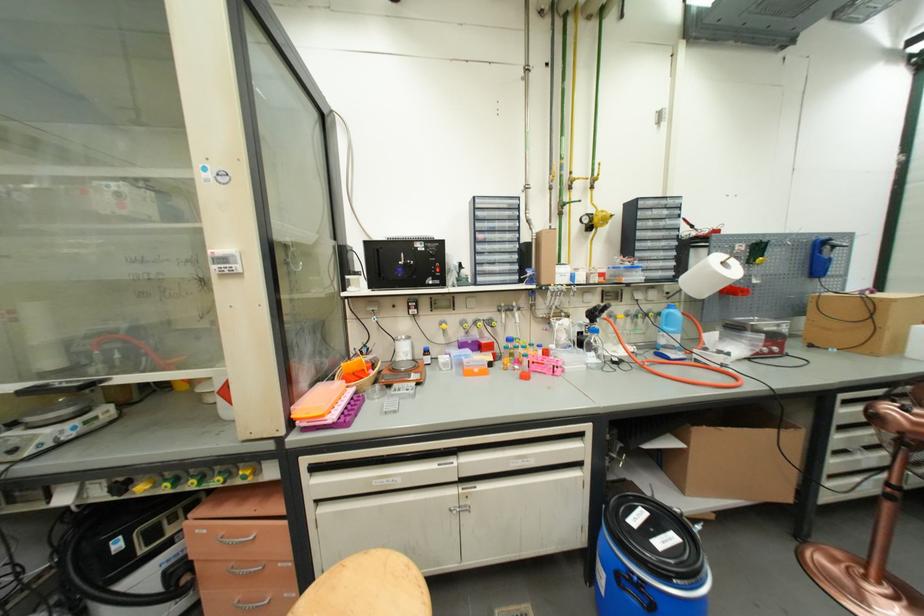
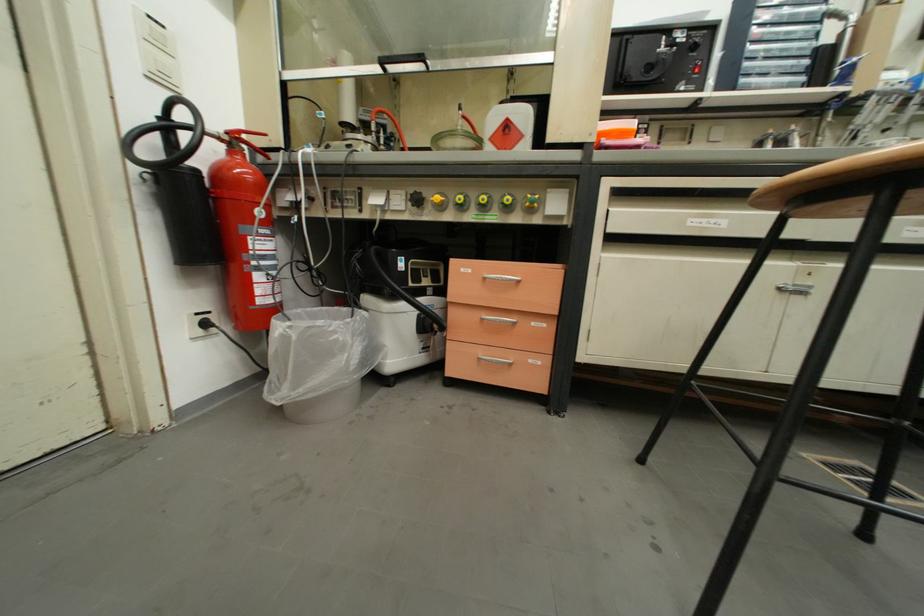
Question: Which direction would the cameraman need to move to produce the second image? Reply with the corresponding letter.

Choices:
 (A) Left
 (B) Right
 (C) Forward
 (D) Backward

Answer: (A)